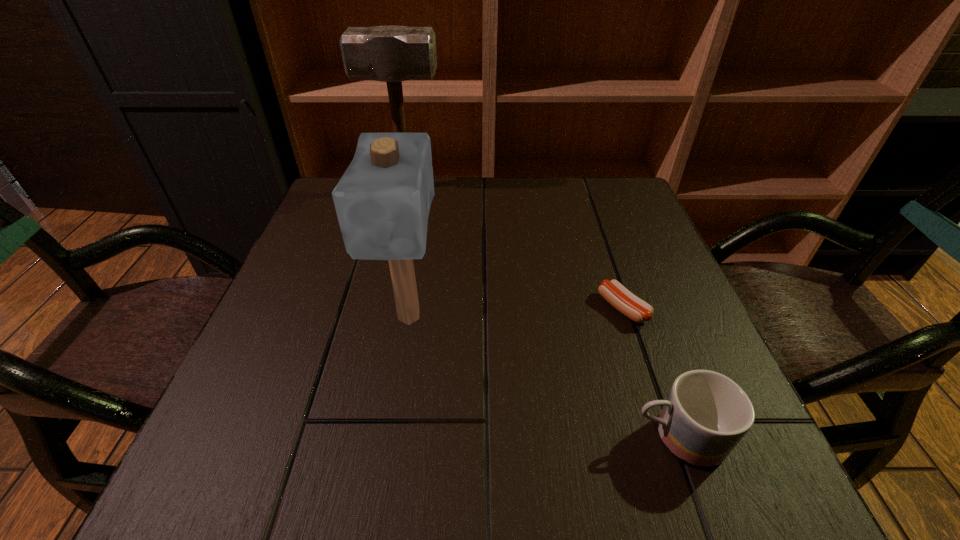
The width and height of the screenshot is (960, 540). Identify the location of blank area located 0.300m on the left of the sausage. (444, 308).

Locate an element on the screen. object that is positioned at the far edge is located at coordinates (392, 54).

Where is `object at the near edge`? Image resolution: width=960 pixels, height=540 pixels. object at the near edge is located at coordinates (706, 414).

Where is `object situated at the left edge`? object situated at the left edge is located at coordinates (392, 54).

At what (x,y) coordinates should I click in order to perform the action: click on mug situated at the right edge. Please return your answer as a coordinate pair (x, y). The width and height of the screenshot is (960, 540). Looking at the image, I should click on (706, 414).

Locate an element on the screen. The width and height of the screenshot is (960, 540). sausage at the right edge is located at coordinates (624, 301).

Where is `object that is at the far left corner`? Image resolution: width=960 pixels, height=540 pixels. object that is at the far left corner is located at coordinates coord(392,54).

This screenshot has width=960, height=540. I want to click on object at the near right corner, so click(706, 414).

The image size is (960, 540). In the image, there is a desktop. Identify the location of vacant space at the far edge. (488, 220).

Locate an element on the screen. The image size is (960, 540). vacant region at the near edge of the desktop is located at coordinates (321, 467).